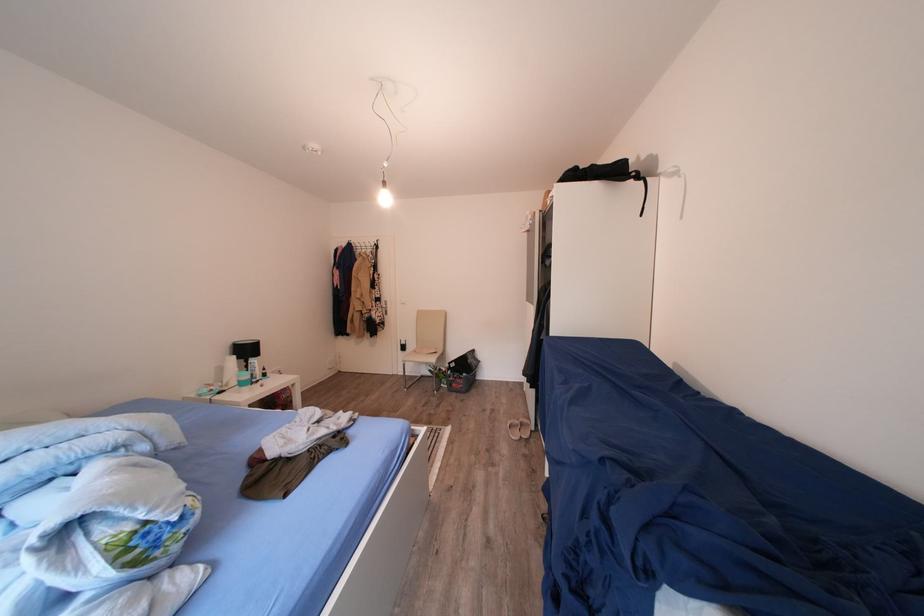
The location [113,525] corresponds to which object?

It refers to a floral patterned pillow.